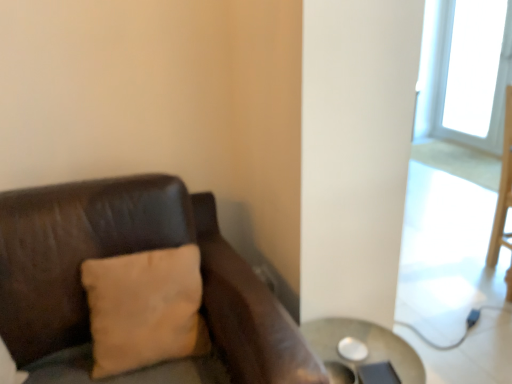
Question: Does metallic silver table at lower right have a lesser height compared to beige fabric pillow at left?

Choices:
 (A) no
 (B) yes

Answer: (B)

Question: From the image's perspective, is metallic silver table at lower right under beige fabric pillow at left?

Choices:
 (A) yes
 (B) no

Answer: (A)

Question: Can you confirm if metallic silver table at lower right is positioned to the left of beige fabric pillow at left?

Choices:
 (A) yes
 (B) no

Answer: (B)

Question: Are metallic silver table at lower right and beige fabric pillow at left far apart?

Choices:
 (A) yes
 (B) no

Answer: (B)

Question: From a real-world perspective, is metallic silver table at lower right physically below beige fabric pillow at left?

Choices:
 (A) yes
 (B) no

Answer: (A)

Question: Does metallic silver table at lower right appear on the right side of beige fabric pillow at left?

Choices:
 (A) no
 (B) yes

Answer: (B)

Question: Is beige fabric pillow at left next to metallic silver table at lower right?

Choices:
 (A) no
 (B) yes

Answer: (A)

Question: Can you confirm if beige fabric pillow at left is positioned to the right of metallic silver table at lower right?

Choices:
 (A) yes
 (B) no

Answer: (B)

Question: Is beige fabric pillow at left taller than metallic silver table at lower right?

Choices:
 (A) no
 (B) yes

Answer: (B)

Question: From a real-world perspective, is beige fabric pillow at left on top of metallic silver table at lower right?

Choices:
 (A) yes
 (B) no

Answer: (A)

Question: Does beige fabric pillow at left lie behind metallic silver table at lower right?

Choices:
 (A) yes
 (B) no

Answer: (B)

Question: Considering the relative sizes of beige fabric pillow at left and metallic silver table at lower right in the image provided, is beige fabric pillow at left thinner than metallic silver table at lower right?

Choices:
 (A) no
 (B) yes

Answer: (B)

Question: Relative to metallic silver table at lower right, is beige fabric pillow at left in front or behind?

Choices:
 (A) front
 (B) behind

Answer: (A)